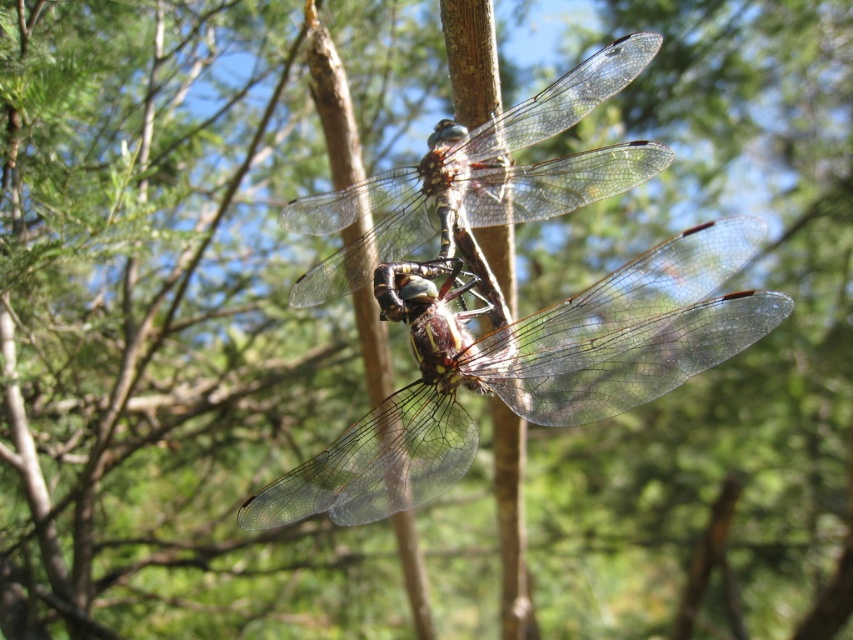
Does translucent glass dragonfly at center have a larger size compared to transparent glass dragonfly at center?

Indeed, translucent glass dragonfly at center has a larger size compared to transparent glass dragonfly at center.

Between translucent glass dragonfly at center and transparent glass dragonfly at center, which one has more height?

Standing taller between the two is translucent glass dragonfly at center.

Which is behind, point (422, 278) or point (650, 173)?

Positioned behind is point (650, 173).

At what (x,y) coordinates should I click in order to perform the action: click on translucent glass dragonfly at center. Please return your answer as a coordinate pair (x, y). Looking at the image, I should click on (526, 368).